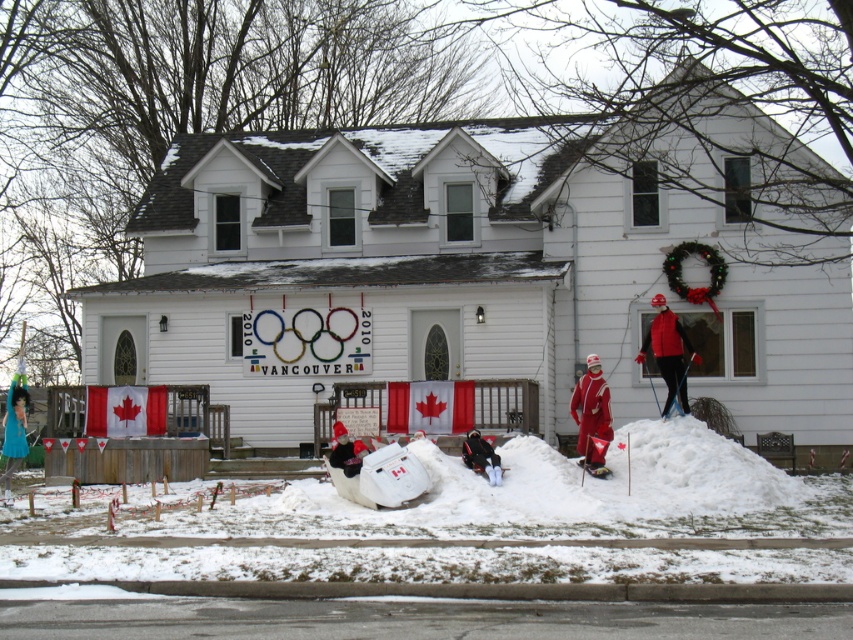
You are a guest arriving at the Olympic house and see the matte red ski suit at center and the white plastic sled at lower center. Which object is placed higher up?

The matte red ski suit at center is positioned over the white plastic sled at lower center, so it is higher up.

You are a delivery person standing at the entrance of the house. You need to place a package between the matte red ski suit at center and the white plastic sled at lower center. The package requires 5 feet of space. Is there enough space between them to place the package?

The distance between the matte red ski suit at center and the white plastic sled at lower center is 6.21 feet, which is more than the required 5 feet. Therefore, there is enough space to place the package between them.

You are standing at the front entrance of the house and see the matte red ski suit at center and the white plastic sled at lower center. Which object is closer to you?

The matte red ski suit at center is closer to you because it is further to the viewer than the white plastic sled at lower center.